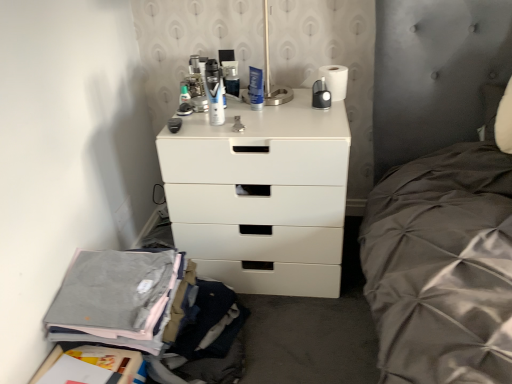
Describe the element at coordinates (184, 94) in the screenshot. This screenshot has height=384, width=512. I see `translucent plastic toothbrush at upper center, the first toiletry positioned from the left` at that location.

How much space does matte black shaving cream can at center, acting as the 3th toiletry starting from the back, occupy horizontally?

It is 4.97 centimeters.

The image size is (512, 384). What do you see at coordinates (261, 197) in the screenshot?
I see `white plastic chest of drawers at center` at bounding box center [261, 197].

You are a GUI agent. You are given a task and a screenshot of the screen. Output one action in this format:
    pyautogui.click(x=<x>, y=<y>)
    Task: Click on the translucent plastic toothbrush at upper center, acting as the 2th toiletry starting from the back
    
    Given the screenshot: What is the action you would take?
    pyautogui.click(x=184, y=94)

Is translucent plastic toothbrush at upper center, the third toiletry from the right, aimed at matte black shaving cream can at center, the second toiletry in the left-to-right sequence?

No.

Which object is further away from the camera taking this photo, translucent plastic toothbrush at upper center, the second toiletry from the front, or matte black shaving cream can at center, the second toiletry in the left-to-right sequence?

translucent plastic toothbrush at upper center, the second toiletry from the front, is more distant.

Does translucent plastic toothbrush at upper center, the first toiletry positioned from the left, have a greater width compared to matte black shaving cream can at center, the 2th toiletry in the right-to-left sequence?

In fact, translucent plastic toothbrush at upper center, the first toiletry positioned from the left, might be narrower than matte black shaving cream can at center, the 2th toiletry in the right-to-left sequence.

Is translucent plastic toothbrush at upper center, the third toiletry from the right, located outside matte black shaving cream can at center, the 1th toiletry viewed from the front?

That's correct, translucent plastic toothbrush at upper center, the third toiletry from the right, is outside of matte black shaving cream can at center, the 1th toiletry viewed from the front.

Based on the photo, from a real-world perspective, which is physically below, metallic silver can at center, which is counted as the first toiletry, starting from the right, or matte black shaving cream can at center, the 1th toiletry viewed from the front?

metallic silver can at center, which is counted as the first toiletry, starting from the right, is physically lower.

Looking at this image, is matte black shaving cream can at center, the second toiletry in the left-to-right sequence, inside metallic silver can at center, which is the third toiletry in left-to-right order?

That's incorrect, matte black shaving cream can at center, the second toiletry in the left-to-right sequence, is not inside metallic silver can at center, which is the third toiletry in left-to-right order.

Is metallic silver can at center, which is counted as the first toiletry, starting from the right, shorter than matte black shaving cream can at center, acting as the 3th toiletry starting from the back?

Indeed, metallic silver can at center, which is counted as the first toiletry, starting from the right, has a lesser height compared to matte black shaving cream can at center, acting as the 3th toiletry starting from the back.

You are a GUI agent. You are given a task and a screenshot of the screen. Output one action in this format:
    pyautogui.click(x=<x>, y=<y>)
    Task: Click on the clothing on the left of translucent plastic toothbrush at upper center, acting as the 2th toiletry starting from the back
    The height and width of the screenshot is (384, 512).
    Given the screenshot: What is the action you would take?
    pyautogui.click(x=116, y=298)

Between translucent plastic toothbrush at upper center, the third toiletry from the right, and gray cotton pants at lower left, which one appears on the right side from the viewer's perspective?

Positioned to the right is translucent plastic toothbrush at upper center, the third toiletry from the right.

Between translucent plastic toothbrush at upper center, acting as the 2th toiletry starting from the back, and gray cotton pants at lower left, which one has smaller size?

With smaller size is translucent plastic toothbrush at upper center, acting as the 2th toiletry starting from the back.

From a real-world perspective, between translucent plastic toothbrush at upper center, the second toiletry from the front, and gray cotton pants at lower left, who is vertically lower?

In real-world perspective, gray cotton pants at lower left is lower.

Does metallic silver can at center, which is counted as the first toiletry, starting from the right, have a larger size compared to translucent plastic toothbrush at upper center, the first toiletry positioned from the left?

Indeed, metallic silver can at center, which is counted as the first toiletry, starting from the right, has a larger size compared to translucent plastic toothbrush at upper center, the first toiletry positioned from the left.

Which object is further away from the camera taking this photo, metallic silver can at center, which is the third toiletry from front to back, or translucent plastic toothbrush at upper center, the second toiletry from the front?

metallic silver can at center, which is the third toiletry from front to back, is further away from the camera.

Is metallic silver can at center, the first toiletry from the back, looking in the opposite direction of translucent plastic toothbrush at upper center, acting as the 2th toiletry starting from the back?

No.

Is metallic silver can at center, the first toiletry from the back, not near translucent plastic toothbrush at upper center, the second toiletry from the front?

They are positioned close to each other.

Is white plastic chest of drawers at center wider or thinner than translucent plastic toothbrush at upper center, the second toiletry from the front?

In the image, white plastic chest of drawers at center appears to be wider than translucent plastic toothbrush at upper center, the second toiletry from the front.

Visually, is white plastic chest of drawers at center positioned to the left or to the right of translucent plastic toothbrush at upper center, acting as the 2th toiletry starting from the back?

In the image, white plastic chest of drawers at center appears on the right side of translucent plastic toothbrush at upper center, acting as the 2th toiletry starting from the back.

From the image's perspective, would you say white plastic chest of drawers at center is shown under translucent plastic toothbrush at upper center, acting as the 2th toiletry starting from the back?

Correct, white plastic chest of drawers at center appears lower than translucent plastic toothbrush at upper center, acting as the 2th toiletry starting from the back, in the image.

Find the location of a particular element. This screenshot has width=512, height=384. clothing in front of the white plastic chest of drawers at center is located at coordinates (116, 298).

Could you tell me if white plastic chest of drawers at center is turned towards gray cotton pants at lower left?

Yes, white plastic chest of drawers at center is facing gray cotton pants at lower left.

From the image's perspective, would you say white plastic chest of drawers at center is positioned over gray cotton pants at lower left?

Yes, from the image's perspective, white plastic chest of drawers at center is on top of gray cotton pants at lower left.

In the scene shown: Are white plastic chest of drawers at center and gray cotton pants at lower left located far from each other?

white plastic chest of drawers at center is actually quite close to gray cotton pants at lower left.

How many degrees apart are the facing directions of gray cotton pants at lower left and metallic silver can at center, the first toiletry from the back?

There is a 88-degree angle between the facing directions of gray cotton pants at lower left and metallic silver can at center, the first toiletry from the back.

Is gray cotton pants at lower left facing towards metallic silver can at center, which is the third toiletry in left-to-right order?

No, gray cotton pants at lower left is not aimed at metallic silver can at center, which is the third toiletry in left-to-right order.

Considering the points (88, 289) and (227, 67), which point is behind, point (88, 289) or point (227, 67)?

The point (227, 67) is farther from the camera.

Which is correct: gray cotton pants at lower left is inside metallic silver can at center, the first toiletry from the back, or outside of it?

The correct answer is: outside.

Locate an element on the screen. The image size is (512, 384). toiletry on the left of the matte black shaving cream can at center, the 1th toiletry viewed from the front is located at coordinates (184, 94).

Locate an element on the screen. toiletry that is on the right side of matte black shaving cream can at center, the 2th toiletry in the right-to-left sequence is located at coordinates (231, 80).

Considering their positions, is gray cotton pants at lower left positioned further to white plastic chest of drawers at center than translucent plastic toothbrush at upper center, the second toiletry from the front?

Among the two, translucent plastic toothbrush at upper center, the second toiletry from the front, is located further to white plastic chest of drawers at center.

Considering their positions, is translucent plastic toothbrush at upper center, the third toiletry from the right, positioned further to white plastic chest of drawers at center than gray cotton pants at lower left?

translucent plastic toothbrush at upper center, the third toiletry from the right.

Looking at the image, which one is located closer to matte black shaving cream can at center, the 2th toiletry in the right-to-left sequence, translucent plastic toothbrush at upper center, acting as the 2th toiletry starting from the back, or metallic silver can at center, which is the third toiletry from front to back?

Based on the image, translucent plastic toothbrush at upper center, acting as the 2th toiletry starting from the back, appears to be nearer to matte black shaving cream can at center, the 2th toiletry in the right-to-left sequence.

Estimate the real-world distances between objects in this image. Which object is closer to metallic silver can at center, which is the third toiletry in left-to-right order, translucent plastic toothbrush at upper center, the third toiletry from the right, or white plastic chest of drawers at center?

The object closer to metallic silver can at center, which is the third toiletry in left-to-right order, is translucent plastic toothbrush at upper center, the third toiletry from the right.

From the image, which object appears to be farther from gray cotton pants at lower left, translucent plastic toothbrush at upper center, acting as the 2th toiletry starting from the back, or white plastic chest of drawers at center?

translucent plastic toothbrush at upper center, acting as the 2th toiletry starting from the back.

Based on their spatial positions, is metallic silver can at center, the first toiletry from the back, or translucent plastic toothbrush at upper center, the second toiletry from the front, closer to matte black shaving cream can at center, acting as the 3th toiletry starting from the back?

translucent plastic toothbrush at upper center, the second toiletry from the front, is closer to matte black shaving cream can at center, acting as the 3th toiletry starting from the back.

Which object lies further to the anchor point translucent plastic toothbrush at upper center, the first toiletry positioned from the left, white plastic chest of drawers at center or gray cotton pants at lower left?

gray cotton pants at lower left lies further to translucent plastic toothbrush at upper center, the first toiletry positioned from the left, than the other object.

Consider the image. Looking at the image, which one is located closer to matte black shaving cream can at center, the 2th toiletry in the right-to-left sequence, gray cotton pants at lower left or white plastic chest of drawers at center?

The object closer to matte black shaving cream can at center, the 2th toiletry in the right-to-left sequence, is white plastic chest of drawers at center.

At what (x,y) coordinates should I click in order to perform the action: click on toiletry between translucent plastic toothbrush at upper center, acting as the 2th toiletry starting from the back, and white plastic chest of drawers at center vertically. Please return your answer as a coordinate pair (x, y). Looking at the image, I should click on (216, 102).

Locate an element on the screen. This screenshot has height=384, width=512. the chest of drawers that lies between metallic silver can at center, which is the third toiletry in left-to-right order, and gray cotton pants at lower left from top to bottom is located at coordinates (261, 197).

This screenshot has width=512, height=384. I want to click on toiletry that lies between translucent plastic toothbrush at upper center, the third toiletry from the right, and gray cotton pants at lower left from top to bottom, so click(x=216, y=102).

What are the coordinates of `chest of drawers between translucent plastic toothbrush at upper center, the first toiletry positioned from the left, and gray cotton pants at lower left in the up-down direction` in the screenshot? It's located at (261, 197).